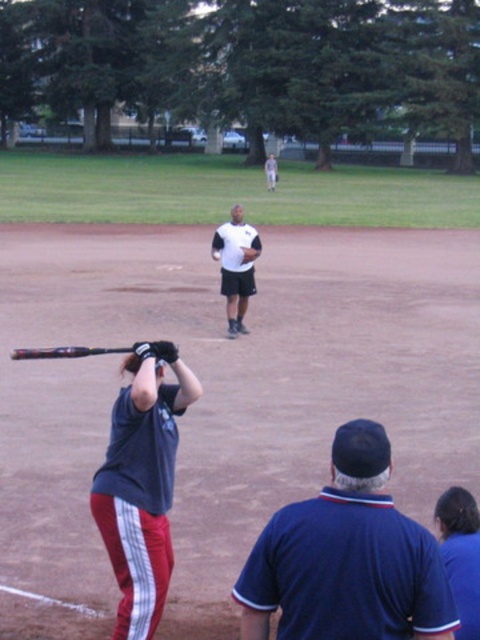
You are a spectator at the baseball game and want to take a photo of both the dark blue fabric cap at upper center and the shiny metallic bat at lower left. Which object should you adjust your camera to focus on first to ensure both are in the frame?

You should focus on the shiny metallic bat at lower left first because the dark blue fabric cap at upper center is to the right of it, so adjusting the camera to include the bat first ensures the cap will also be captured to its right.